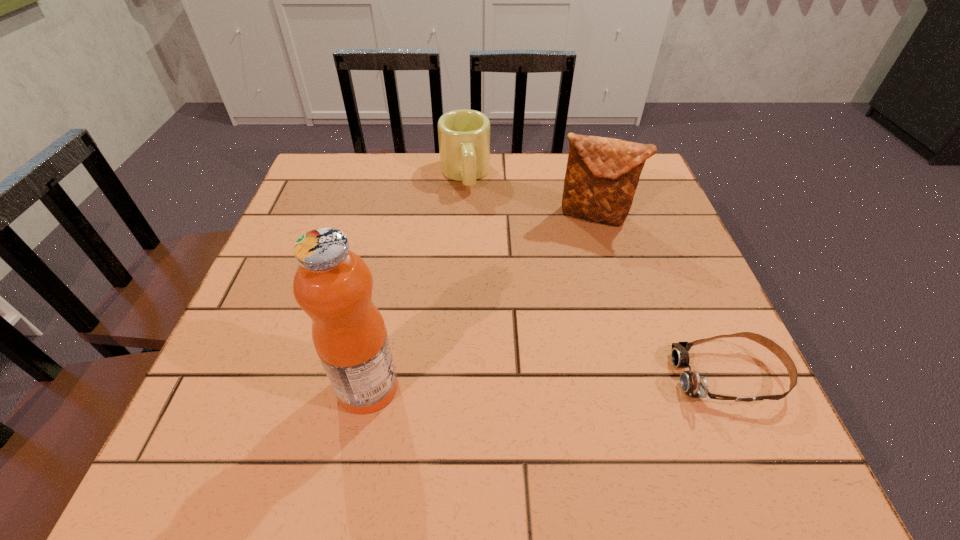
I want to click on the tallest object, so click(x=333, y=285).

At what (x,y) coordinates should I click in order to perform the action: click on the leftmost object. Please return your answer as a coordinate pair (x, y). The width and height of the screenshot is (960, 540). Looking at the image, I should click on 333,285.

The height and width of the screenshot is (540, 960). I want to click on the shortest object, so click(x=695, y=386).

Where is `clutch bag`? The width and height of the screenshot is (960, 540). clutch bag is located at coordinates (602, 174).

In order to click on the second tallest object in this screenshot , I will do `click(602, 174)`.

At what (x,y) coordinates should I click in order to perform the action: click on the second shortest object. Please return your answer as a coordinate pair (x, y). The image size is (960, 540). Looking at the image, I should click on (464, 135).

What are the coordinates of `mug` in the screenshot? It's located at (464, 135).

I want to click on free region located 0.250m on the right of the leftmost object, so click(x=544, y=387).

Image resolution: width=960 pixels, height=540 pixels. Identify the location of vacant region located on the front-facing side of the shortest object. (511, 376).

This screenshot has width=960, height=540. In order to click on vacant space located 0.230m on the front-facing side of the shortest object in this screenshot , I will do `click(545, 376)`.